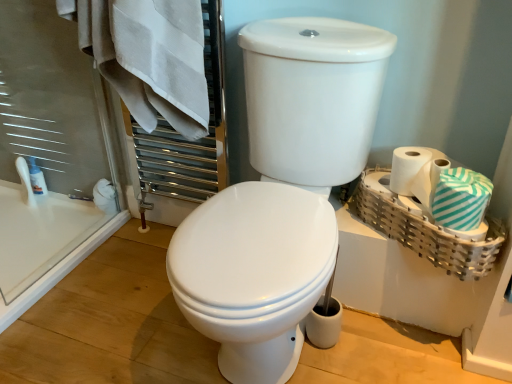
Question: Does teal striped fabric at right, positioned as the second bath towel in left-to-right order, turn towards white matte toilet paper at right?

Choices:
 (A) no
 (B) yes

Answer: (A)

Question: Considering the relative sizes of teal striped fabric at right, which is counted as the 2th bath towel, starting from the top, and white matte toilet paper at right in the image provided, is teal striped fabric at right, which is counted as the 2th bath towel, starting from the top, wider than white matte toilet paper at right?

Choices:
 (A) no
 (B) yes

Answer: (B)

Question: Does teal striped fabric at right, which is counted as the 2th bath towel, starting from the top, contain white matte toilet paper at right?

Choices:
 (A) no
 (B) yes

Answer: (A)

Question: From a real-world perspective, is teal striped fabric at right, which is the first bath towel from bottom to top, physically below white matte toilet paper at right?

Choices:
 (A) no
 (B) yes

Answer: (A)

Question: Is teal striped fabric at right, which ranks as the 1th bath towel in right-to-left order, to the right of white matte toilet paper at right from the viewer's perspective?

Choices:
 (A) yes
 (B) no

Answer: (A)

Question: From a real-world perspective, is bamboo woven basket at right physically located above or below white glossy toilet at center?

Choices:
 (A) above
 (B) below

Answer: (B)

Question: In the image, is bamboo woven basket at right on the left side or the right side of white glossy toilet at center?

Choices:
 (A) left
 (B) right

Answer: (B)

Question: Considering the positions of bamboo woven basket at right and white glossy toilet at center in the image, is bamboo woven basket at right wider or thinner than white glossy toilet at center?

Choices:
 (A) thin
 (B) wide

Answer: (A)

Question: Considering their positions, is bamboo woven basket at right located in front of or behind white glossy toilet at center?

Choices:
 (A) behind
 (B) front

Answer: (A)

Question: Considering their positions, is white glossy lotion at left located in front of or behind white matte toilet paper at right?

Choices:
 (A) behind
 (B) front

Answer: (A)

Question: From the image's perspective, relative to white matte toilet paper at right, is white glossy lotion at left above or below?

Choices:
 (A) above
 (B) below

Answer: (A)

Question: Based on their sizes in the image, would you say white glossy lotion at left is bigger or smaller than white matte toilet paper at right?

Choices:
 (A) big
 (B) small

Answer: (B)

Question: From their relative heights in the image, would you say white glossy lotion at left is taller or shorter than white matte toilet paper at right?

Choices:
 (A) short
 (B) tall

Answer: (B)

Question: Is point (259, 269) positioned closer to the camera than point (156, 81)?

Choices:
 (A) closer
 (B) farther

Answer: (A)

Question: In the image, is white glossy toilet at center on the left side or the right side of white cotton towel at upper left, positioned as the 1th bath towel in left-to-right order?

Choices:
 (A) left
 (B) right

Answer: (B)